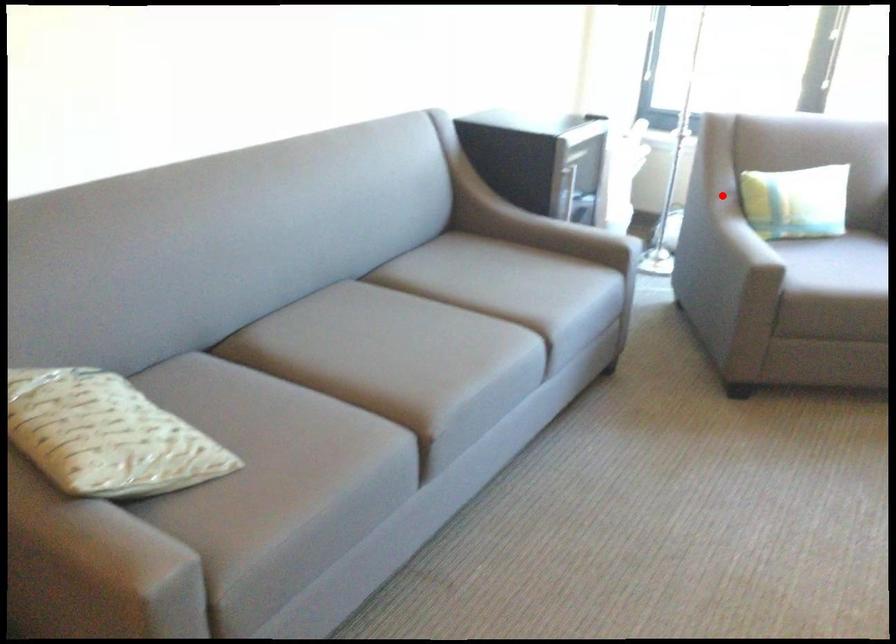
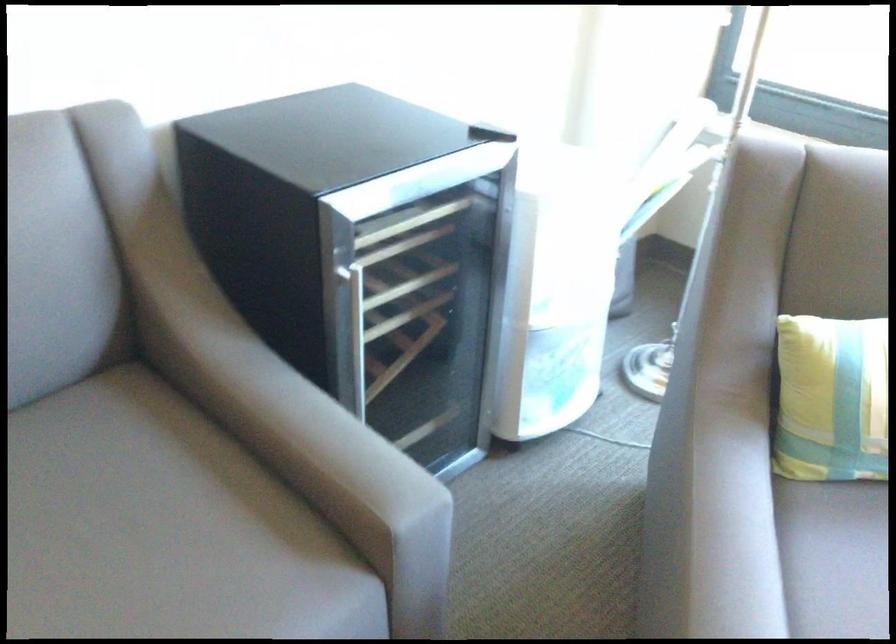
Question: I am providing you with two images of the same scene from different viewpoints. A red point is shown in image1. For the corresponding object point in image2, is it positioned nearer or farther from the camera?

Choices:
 (A) Nearer
 (B) Farther

Answer: (A)